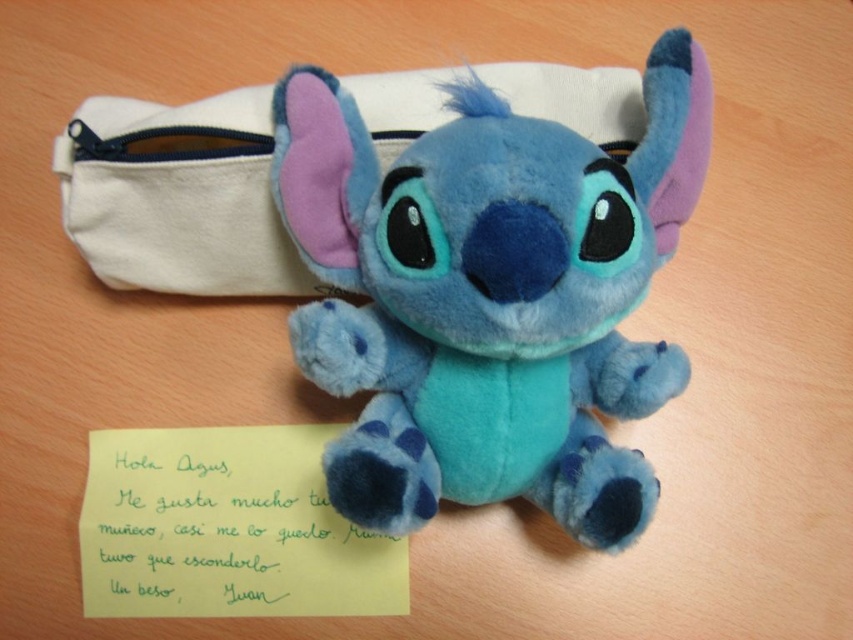
You are organizing your desk and want to place a small sticker between the soft blue plush toy at center and the white canvas pouch at upper center. The sticker is 15 centimeters long. Will the sticker fit between them without overlapping either item?

The distance between the soft blue plush toy at center and the white canvas pouch at upper center is 18.01 centimeters. Since the sticker is 15 centimeters long, it will fit between them without overlapping either item as there is enough space.

You are organizing your desk and notice the soft blue plush toy at center and the yellow paper at center. Which item takes up more vertical space?

The soft blue plush toy at center is taller than the yellow paper at center, so it takes up more vertical space.